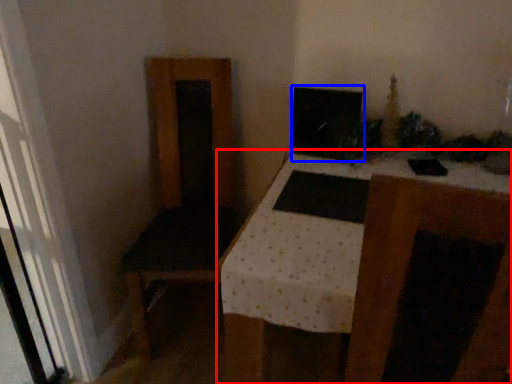
Question: Which object is closer to the camera taking this photo, table (highlighted by a red box) or computer monitor (highlighted by a blue box)?

Choices:
 (A) table
 (B) computer monitor

Answer: (A)